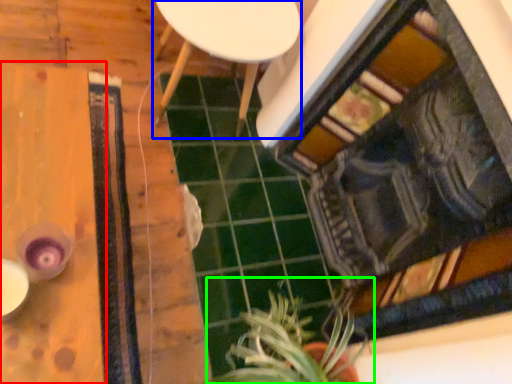
Question: Which is nearer to the table (highlighted by a red box)? furniture (highlighted by a blue box) or houseplant (highlighted by a green box).

Choices:
 (A) furniture
 (B) houseplant

Answer: (A)